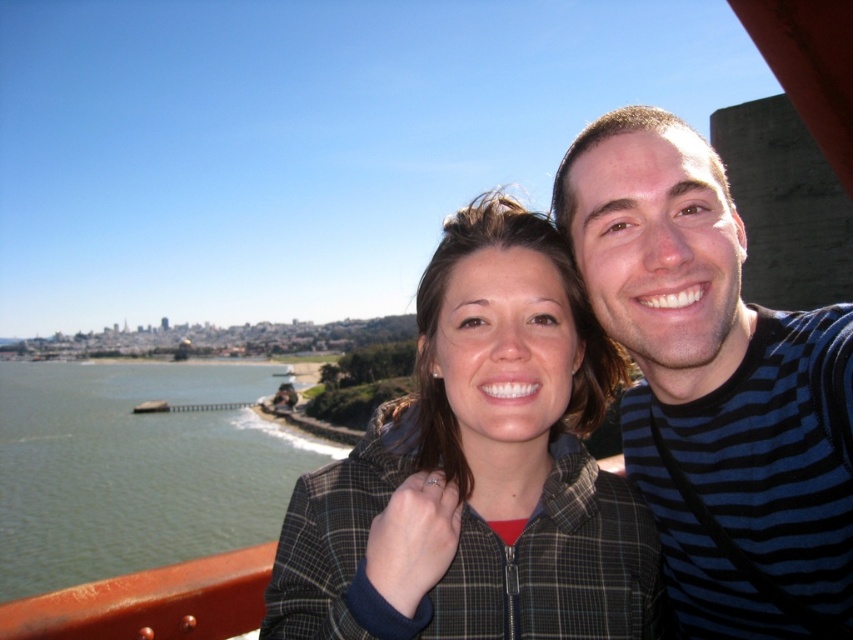
You are a photographer trying to capture the scenic view of the city. You notice the blue striped shirt at upper right and the green water at lower left in your frame. Which object takes up more space in the photo?

The green water at lower left takes up more space in the photo because the blue striped shirt at upper right has a lesser width compared to it.

You are a photographer trying to capture a clear shot of both the plaid jacket at center and the blue striped shirt at upper right. Which person should you adjust your focus on to ensure both are in focus?

You should focus on the plaid jacket at center because it is closer to you than the blue striped shirt at upper right, so adjusting focus on it will help both be in focus.

You are standing at the bridge where the selfie was taken. You want to throw a small pebble into the plaid jacket at center. Is the distance feasible for you to reach?

The plaid jacket at center is 39.45 meters away from the viewer, so it is not feasible to reach that distance by throwing a small pebble.